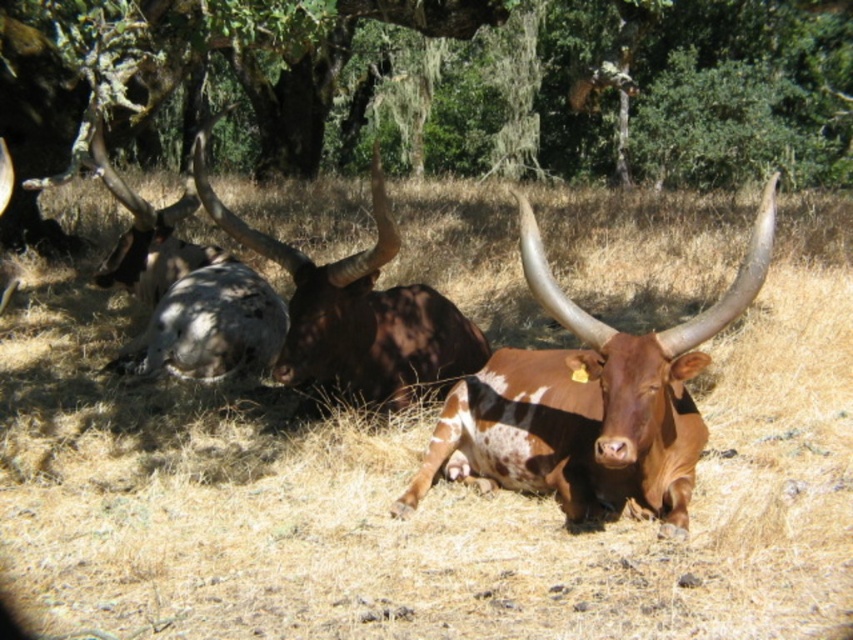
Question: Does brown speckled hide at center come behind speckled fur at left?

Choices:
 (A) no
 (B) yes

Answer: (A)

Question: Which of the following is the closest to the observer?

Choices:
 (A) (245, 296)
 (B) (416, 54)
 (C) (468, 385)
 (D) (448, 582)

Answer: (D)

Question: Estimate the real-world distances between objects in this image. Which object is closer to the brown dry grass at center?

Choices:
 (A) speckled fur at left
 (B) green leafy tree at upper center

Answer: (A)

Question: Does brown speckled hide at center have a lesser width compared to speckled fur at left?

Choices:
 (A) yes
 (B) no

Answer: (A)

Question: Which object is farther from the camera taking this photo?

Choices:
 (A) brown rough textured bull at center
 (B) green leafy tree at upper center

Answer: (B)

Question: Does brown rough textured bull at center have a smaller size compared to speckled fur at left?

Choices:
 (A) yes
 (B) no

Answer: (A)